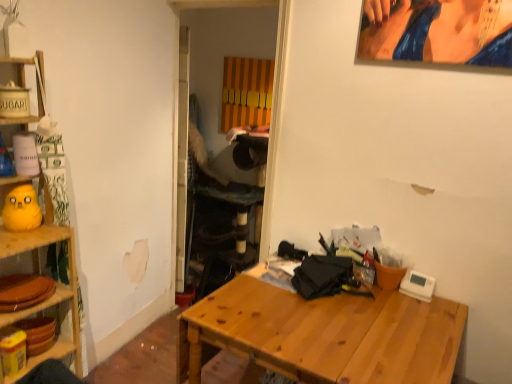
What do you see at coordinates (325, 334) in the screenshot? The image size is (512, 384). I see `wooden table at center` at bounding box center [325, 334].

You are a GUI agent. You are given a task and a screenshot of the screen. Output one action in this format:
    pyautogui.click(x=<x>, y=<y>)
    Task: Click on the wooden shelf at left
    
    Given the screenshot: What is the action you would take?
    pyautogui.click(x=40, y=272)

The height and width of the screenshot is (384, 512). Identify the location of wooden table at center. (325, 334).

Considering the positions of objects yellow rubber duck at left and wooden shelf at left in the image provided, who is more to the left, yellow rubber duck at left or wooden shelf at left?

From the viewer's perspective, wooden shelf at left appears more on the left side.

At what (x,y) coordinates should I click in order to perform the action: click on toy located above the wooden shelf at left (from a real-world perspective). Please return your answer as a coordinate pair (x, y). This screenshot has height=384, width=512. Looking at the image, I should click on (21, 209).

From the image's perspective, is yellow rubber duck at left located above wooden shelf at left?

Indeed, from the image's perspective, yellow rubber duck at left is shown above wooden shelf at left.

In terms of height, does yellow rubber duck at left look taller or shorter compared to wooden table at center?

Considering their sizes, yellow rubber duck at left has less height than wooden table at center.

Is yellow rubber duck at left situated inside wooden table at center or outside?

yellow rubber duck at left is not inside wooden table at center, it's outside.

Considering the sizes of objects yellow rubber duck at left and wooden table at center in the image provided, who is wider, yellow rubber duck at left or wooden table at center?

wooden table at center.

Is yellow rubber duck at left looking in the opposite direction of wooden table at center?

yellow rubber duck at left does not have its back to wooden table at center.

Considering the positions of objects wooden table at center and wooden shelf at left in the image provided, who is more to the left, wooden table at center or wooden shelf at left?

Positioned to the left is wooden shelf at left.

Is wooden shelf at left inside wooden table at center?

No, wooden shelf at left is not inside wooden table at center.

Can wooden table at center be found inside wooden shelf at left?

No, wooden shelf at left does not contain wooden table at center.

In terms of size, does wooden shelf at left appear bigger or smaller than wooden table at center?

wooden shelf at left is smaller than wooden table at center.

Is wooden shelf at left facing towards wooden table at center?

No, wooden shelf at left is not facing towards wooden table at center.

How different are the orientations of wooden shelf at left and wooden table at center in degrees?

The angular difference between wooden shelf at left and wooden table at center is 88.9 degrees.

Which is more to the left, wooden shelf at left or yellow rubber duck at left?

From the viewer's perspective, wooden shelf at left appears more on the left side.

Which object is closer to the camera taking this photo, wooden shelf at left or yellow rubber duck at left?

wooden shelf at left is more forward.

From the picture: From the image's perspective, is wooden shelf at left located above or below yellow rubber duck at left?

Based on their image positions, wooden shelf at left is located beneath yellow rubber duck at left.

Does point (42, 85) come farther from viewer compared to point (33, 225)?

Yes, point (42, 85) is farther from viewer.

This screenshot has width=512, height=384. What are the coordinates of `toy located on the left of wooden table at center` in the screenshot? It's located at (21, 209).

Is wooden table at center inside or outside of yellow rubber duck at left?

The correct answer is: outside.

Can you tell me how much wooden table at center and yellow rubber duck at left differ in facing direction?

86.1 degrees separate the facing orientations of wooden table at center and yellow rubber duck at left.

Is wooden table at center wider or thinner than yellow rubber duck at left?

Considering their sizes, wooden table at center looks broader than yellow rubber duck at left.

Where is `shelf below the yellow rubber duck at left (from the image's perspective)`? shelf below the yellow rubber duck at left (from the image's perspective) is located at coordinates (40, 272).

Find the location of `toy that is behind the wooden table at center`. toy that is behind the wooden table at center is located at coordinates (21, 209).

From the image, which object appears to be nearer to yellow rubber duck at left, wooden table at center or wooden shelf at left?

wooden shelf at left lies closer to yellow rubber duck at left than the other object.

Based on their spatial positions, is wooden shelf at left or yellow rubber duck at left further from wooden table at center?

Among the two, yellow rubber duck at left is located further to wooden table at center.

Considering their positions, is wooden table at center positioned further to wooden shelf at left than yellow rubber duck at left?

wooden table at center is positioned further to the anchor wooden shelf at left.

Looking at the image, which one is located closer to yellow rubber duck at left, wooden shelf at left or wooden table at center?

wooden shelf at left.

Looking at the image, which one is located further to wooden table at center, yellow rubber duck at left or wooden shelf at left?

yellow rubber duck at left is further to wooden table at center.

When comparing their distances from wooden shelf at left, does yellow rubber duck at left or wooden table at center seem further?

wooden table at center.

This screenshot has height=384, width=512. Find the location of `toy situated between wooden shelf at left and wooden table at center from left to right`. toy situated between wooden shelf at left and wooden table at center from left to right is located at coordinates (21, 209).